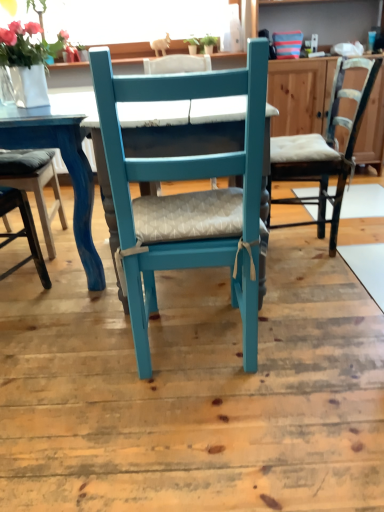
Question: Is the depth of matte white vase at upper left greater than that of matte blue table at left, the first table viewed from the left?

Choices:
 (A) no
 (B) yes

Answer: (B)

Question: Does matte white vase at upper left have a smaller size compared to matte blue table at left, the first table viewed from the left?

Choices:
 (A) yes
 (B) no

Answer: (A)

Question: Can you confirm if matte white vase at upper left is positioned to the left of matte blue table at left, the first table viewed from the left?

Choices:
 (A) no
 (B) yes

Answer: (B)

Question: Can you confirm if matte white vase at upper left is thinner than matte blue table at left, which is the second table from right to left?

Choices:
 (A) yes
 (B) no

Answer: (A)

Question: From the image's perspective, is matte white vase at upper left located above matte blue table at left, which is the second table from right to left?

Choices:
 (A) yes
 (B) no

Answer: (A)

Question: Is point (36, 46) positioned closer to the camera than point (324, 219)?

Choices:
 (A) farther
 (B) closer

Answer: (B)

Question: Considering the positions of matte white vase at upper left and matte white cushioned chair at right, marked as the 2th chair in a left-to-right arrangement, in the image, is matte white vase at upper left bigger or smaller than matte white cushioned chair at right, marked as the 2th chair in a left-to-right arrangement,?

Choices:
 (A) small
 (B) big

Answer: (A)

Question: Considering the positions of matte white vase at upper left and matte white cushioned chair at right, marked as the 2th chair in a left-to-right arrangement, in the image, is matte white vase at upper left taller or shorter than matte white cushioned chair at right, marked as the 2th chair in a left-to-right arrangement,?

Choices:
 (A) short
 (B) tall

Answer: (A)

Question: From the image's perspective, is matte white vase at upper left positioned above or below matte white cushioned chair at right, the 1th chair when ordered from right to left?

Choices:
 (A) above
 (B) below

Answer: (A)

Question: Which is correct: matte blue table at left, which is the second table from right to left, is inside teal painted wood chair at center, the first chair positioned from the left, or outside of it?

Choices:
 (A) inside
 (B) outside

Answer: (B)

Question: From their relative heights in the image, would you say matte blue table at left, the first table viewed from the left, is taller or shorter than teal painted wood chair at center, the 1th chair from the front?

Choices:
 (A) short
 (B) tall

Answer: (A)

Question: Considering the positions of matte blue table at left, the first table viewed from the left, and teal painted wood chair at center, the first chair positioned from the left, in the image, is matte blue table at left, the first table viewed from the left, wider or thinner than teal painted wood chair at center, the first chair positioned from the left,?

Choices:
 (A) thin
 (B) wide

Answer: (B)

Question: From a real-world perspective, relative to teal painted wood chair at center, which is the second chair from back to front, is matte blue table at left, which is the second table from right to left, vertically above or below?

Choices:
 (A) above
 (B) below

Answer: (B)

Question: Is point (332, 92) positioned closer to the camera than point (81, 206)?

Choices:
 (A) farther
 (B) closer

Answer: (A)

Question: From the image's perspective, is matte white cushioned chair at right, which is counted as the second chair, starting from the front, located above or below matte blue chair at center, which ranks as the 2th table in left-to-right order?

Choices:
 (A) below
 (B) above

Answer: (B)